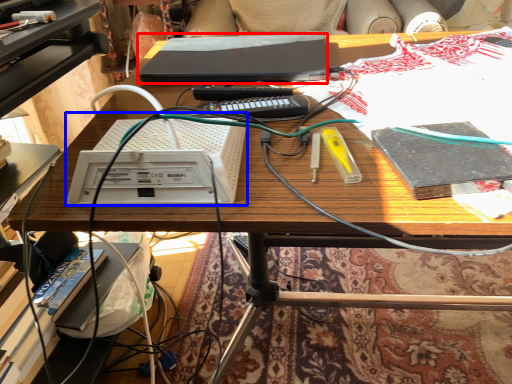
Question: Which point is further to the camera, computer (highlighted by a red box) or equipment (highlighted by a blue box)?

Choices:
 (A) computer
 (B) equipment

Answer: (A)